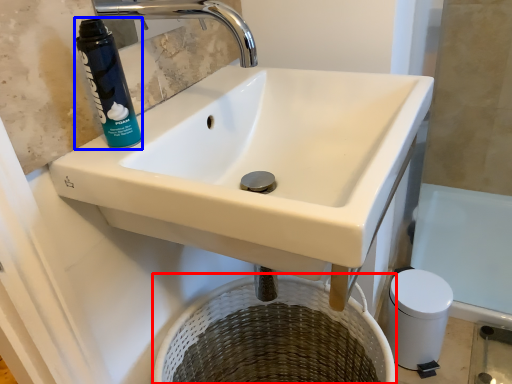
Question: Which object is further to the camera taking this photo, basket (highlighted by a red box) or cleaning product (highlighted by a blue box)?

Choices:
 (A) basket
 (B) cleaning product

Answer: (A)